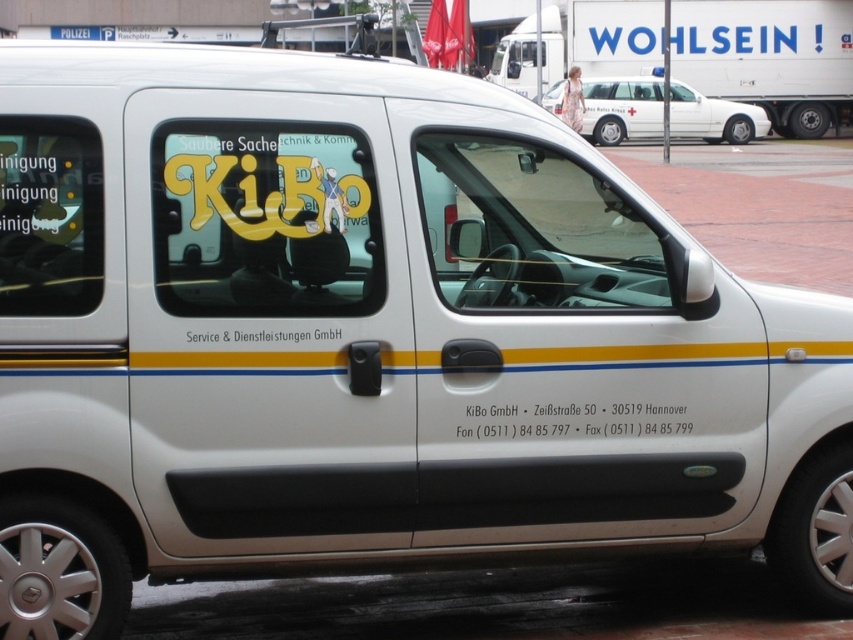
Question: Which object is farther from the camera taking this photo?

Choices:
 (A) white matte text at center
 (B) white glossy ambulance at upper center
 (C) white glossy car at upper center
 (D) white matte text at lower center

Answer: (B)

Question: Among these points, which one is nearest to the camera?

Choices:
 (A) (706, 90)
 (B) (654, 413)

Answer: (B)

Question: Is white glossy ambulance at upper center positioned in front of white matte text at center?

Choices:
 (A) no
 (B) yes

Answer: (A)

Question: Is white glossy ambulance at upper center positioned before white matte text at lower center?

Choices:
 (A) yes
 (B) no

Answer: (B)

Question: Which point is closer to the camera?

Choices:
 (A) white matte text at center
 (B) white glossy ambulance at upper center
 (C) white glossy car at upper center
 (D) white matte text at lower center

Answer: (A)

Question: Is white matte text at lower center behind white matte text at center?

Choices:
 (A) yes
 (B) no

Answer: (A)